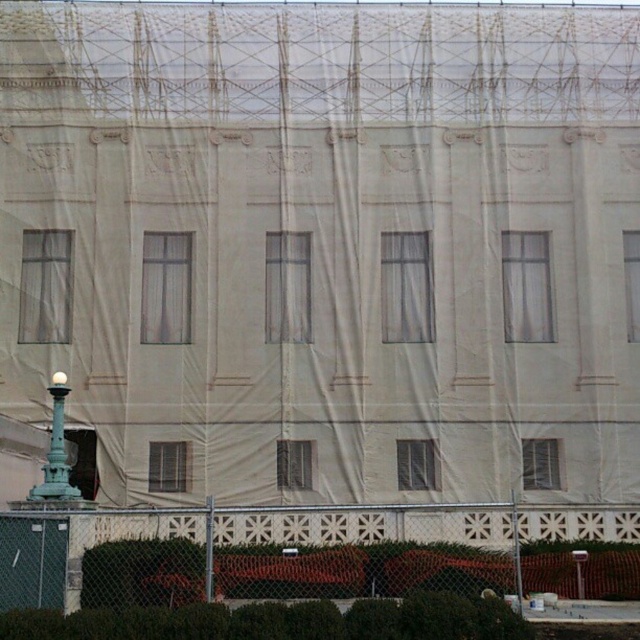
Who is positioned more to the left, metal chain-link fence at lower center or green patinated metal lamp post at lower left?

Positioned to the left is green patinated metal lamp post at lower left.

Can you confirm if metal chain-link fence at lower center is positioned to the left of green patinated metal lamp post at lower left?

No, metal chain-link fence at lower center is not to the left of green patinated metal lamp post at lower left.

Does point (92, 557) come behind point (52, 403)?

No, it is not.

The image size is (640, 640). Find the location of `metal chain-link fence at lower center`. metal chain-link fence at lower center is located at coordinates (291, 552).